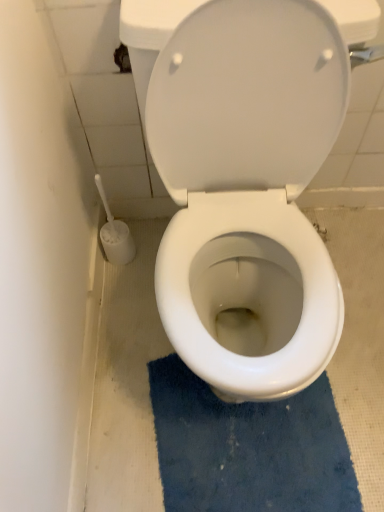
What do you see at coordinates (248, 190) in the screenshot? I see `white glossy toilet at center` at bounding box center [248, 190].

In order to face white glossy toilet at center, should I rotate leftwards or rightwards?

To face it directly, rotate right by 7.122 degrees.

The height and width of the screenshot is (512, 384). In order to click on white glossy toilet at center in this screenshot , I will do `click(248, 190)`.

What are the coordinates of `blue textured bath mat at center` in the screenshot? It's located at (248, 448).

What do you see at coordinates (248, 448) in the screenshot? This screenshot has width=384, height=512. I see `blue textured bath mat at center` at bounding box center [248, 448].

Where is `white glossy toilet at center`? white glossy toilet at center is located at coordinates (248, 190).

Does blue textured bath mat at center appear on the right side of white glossy toilet at center?

Yes, blue textured bath mat at center is to the right of white glossy toilet at center.

In the image, is blue textured bath mat at center positioned in front of or behind white glossy toilet at center?

Clearly, blue textured bath mat at center is behind white glossy toilet at center.

Which is farther from the camera, [252,424] or [254,135]?

Point [252,424]

From the image's perspective, which is above, blue textured bath mat at center or white glossy toilet at center?

From the image's view, white glossy toilet at center is above.

From a real-world perspective, between blue textured bath mat at center and white glossy toilet at center, who is vertically higher?

white glossy toilet at center, from a real-world perspective.

From the picture: Does blue textured bath mat at center have a greater width compared to white glossy toilet at center?

Incorrect, the width of blue textured bath mat at center does not surpass that of white glossy toilet at center.

Considering the relative sizes of blue textured bath mat at center and white glossy toilet at center in the image provided, is blue textured bath mat at center shorter than white glossy toilet at center?

Correct, blue textured bath mat at center is not as tall as white glossy toilet at center.

Considering the sizes of blue textured bath mat at center and white glossy toilet at center in the image, is blue textured bath mat at center bigger or smaller than white glossy toilet at center?

blue textured bath mat at center is smaller than white glossy toilet at center.

Which is correct: blue textured bath mat at center is inside white glossy toilet at center, or outside of it?

blue textured bath mat at center is not inside white glossy toilet at center, it's outside.

Are blue textured bath mat at center and white glossy toilet at center making contact?

No, blue textured bath mat at center is not in contact with white glossy toilet at center.

Is blue textured bath mat at center facing away from white glossy toilet at center?

No.

What's the angular difference between blue textured bath mat at center and white glossy toilet at center's facing directions?

The angle between the facing direction of blue textured bath mat at center and the facing direction of white glossy toilet at center is 6.98 degrees.

Find the location of a particular element. bath mat behind the white glossy toilet at center is located at coordinates (248, 448).

Looking at this image, which object is positioned more to the right, white glossy toilet at center or blue textured bath mat at center?

From the viewer's perspective, blue textured bath mat at center appears more on the right side.

Considering the positions of objects white glossy toilet at center and blue textured bath mat at center in the image provided, who is in front, white glossy toilet at center or blue textured bath mat at center?

Positioned in front is white glossy toilet at center.

Does point (165, 86) appear closer or farther from the camera than point (329, 498)?

Point (165, 86) is positioned closer to the camera compared to point (329, 498).

From the image's perspective, which object appears higher, white glossy toilet at center or blue textured bath mat at center?

white glossy toilet at center is shown above in the image.

From a real-world perspective, is white glossy toilet at center physically located above or below blue textured bath mat at center?

In terms of real-world spatial position, white glossy toilet at center is above blue textured bath mat at center.

Which object is thinner, white glossy toilet at center or blue textured bath mat at center?

blue textured bath mat at center is thinner.

Is white glossy toilet at center taller than blue textured bath mat at center?

Yes, white glossy toilet at center is taller than blue textured bath mat at center.

Does white glossy toilet at center have a larger size compared to blue textured bath mat at center?

Correct, white glossy toilet at center is larger in size than blue textured bath mat at center.

Is blue textured bath mat at center located within white glossy toilet at center?

No, blue textured bath mat at center is not inside white glossy toilet at center.

Is there a large distance between white glossy toilet at center and blue textured bath mat at center?

No, white glossy toilet at center is in close proximity to blue textured bath mat at center.

Is white glossy toilet at center oriented away from blue textured bath mat at center?

No, white glossy toilet at center is not facing the opposite direction of blue textured bath mat at center.

Can you tell me how much white glossy toilet at center and blue textured bath mat at center differ in facing direction?

The angular difference between white glossy toilet at center and blue textured bath mat at center is 6.98 degrees.

Identify the location of toilet located above the blue textured bath mat at center (from a real-world perspective). (248, 190).

The height and width of the screenshot is (512, 384). Find the location of `toilet lying above the blue textured bath mat at center (from the image's perspective)`. toilet lying above the blue textured bath mat at center (from the image's perspective) is located at coordinates (248, 190).

This screenshot has height=512, width=384. Identify the location of bath mat below the white glossy toilet at center (from the image's perspective). (248, 448).